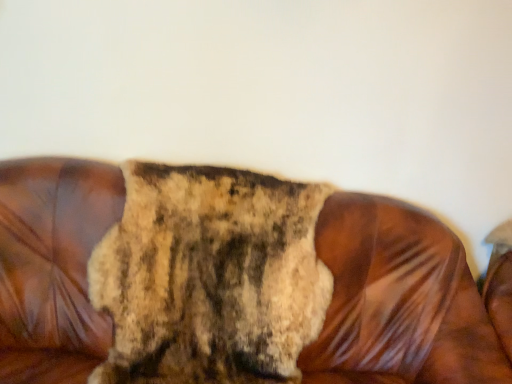
Find the location of a particular element. brown leather couch at center is located at coordinates (399, 301).

Describe the element at coordinates (399, 301) in the screenshot. I see `brown leather couch at center` at that location.

The image size is (512, 384). Identify the location of brown leather couch at center. (399, 301).